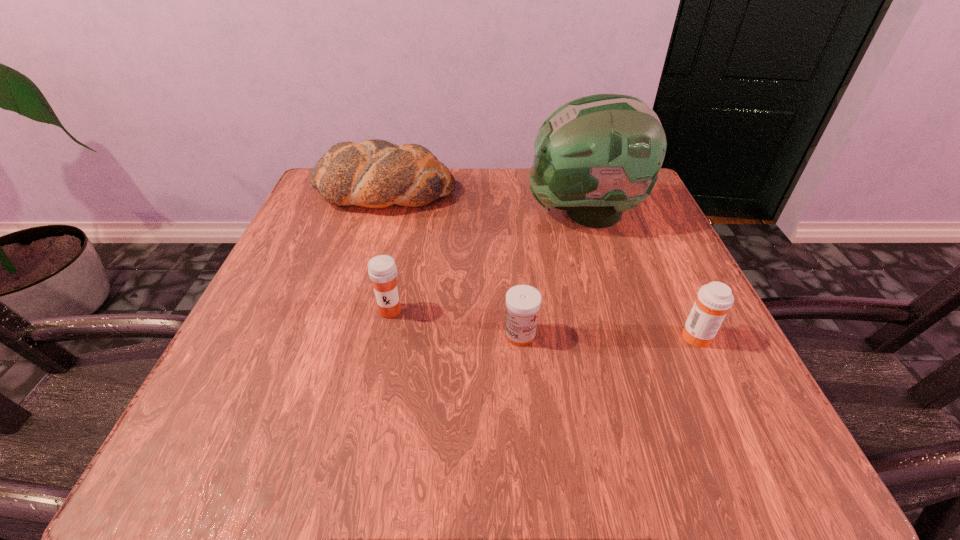
Find the location of `vacant area that satisfies the following two spatial constraints: 1. on the visor of the football helmet; 2. on the back side of the rightmost medicine`. vacant area that satisfies the following two spatial constraints: 1. on the visor of the football helmet; 2. on the back side of the rightmost medicine is located at coordinates (623, 335).

Image resolution: width=960 pixels, height=540 pixels. In order to click on free space that satisfies the following two spatial constraints: 1. on the label side of the second medicine from left to right; 2. on the right side of the leftmost medicine in this screenshot , I will do `click(385, 335)`.

Find the location of a particular element. Image resolution: width=960 pixels, height=540 pixels. free space in the image that satisfies the following two spatial constraints: 1. on the front side of the bread; 2. on the right side of the rightmost medicine is located at coordinates (340, 335).

Image resolution: width=960 pixels, height=540 pixels. Identify the location of vacant space that satisfies the following two spatial constraints: 1. on the front side of the rightmost medicine; 2. on the left side of the third object from left to right. (520, 335).

Where is `blank space that satisfies the following two spatial constraints: 1. on the visor of the tallest object; 2. on the label side of the third farthest object`? The image size is (960, 540). blank space that satisfies the following two spatial constraints: 1. on the visor of the tallest object; 2. on the label side of the third farthest object is located at coordinates pyautogui.click(x=615, y=311).

Image resolution: width=960 pixels, height=540 pixels. Identify the location of vacant area that satisfies the following two spatial constraints: 1. on the back side of the rightmost medicine; 2. on the visor of the football helmet. tap(638, 213).

Locate an element on the screen. Image resolution: width=960 pixels, height=540 pixels. free space that satisfies the following two spatial constraints: 1. on the visor of the tallest object; 2. on the back side of the rightmost medicine is located at coordinates (623, 335).